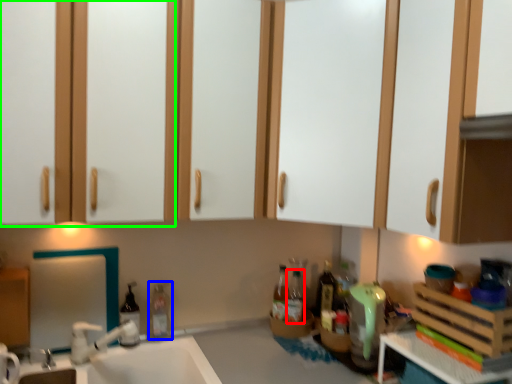
Question: Which is nearer to the bottle (highlighted by a red box)? bottle (highlighted by a blue box) or cabinetry (highlighted by a green box).

Choices:
 (A) bottle
 (B) cabinetry

Answer: (A)